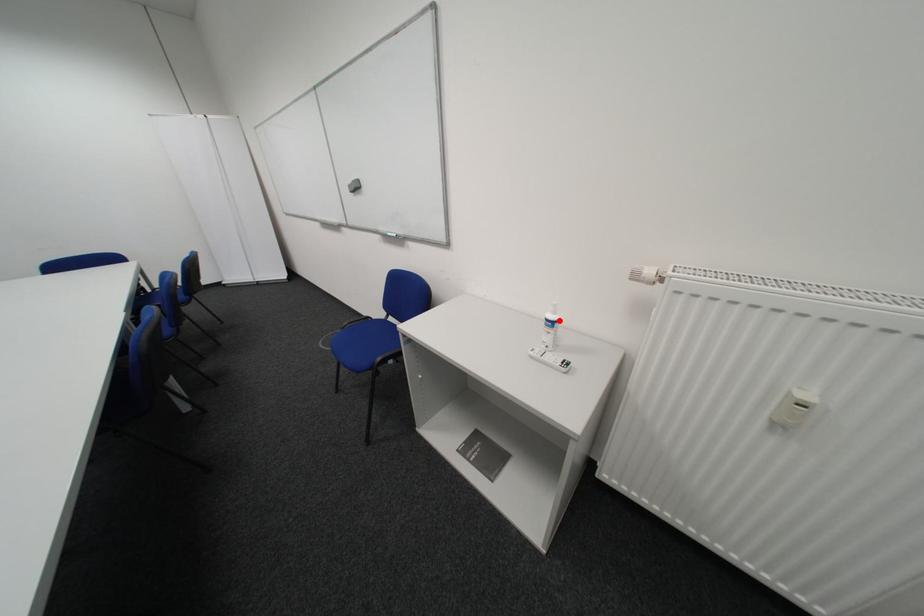
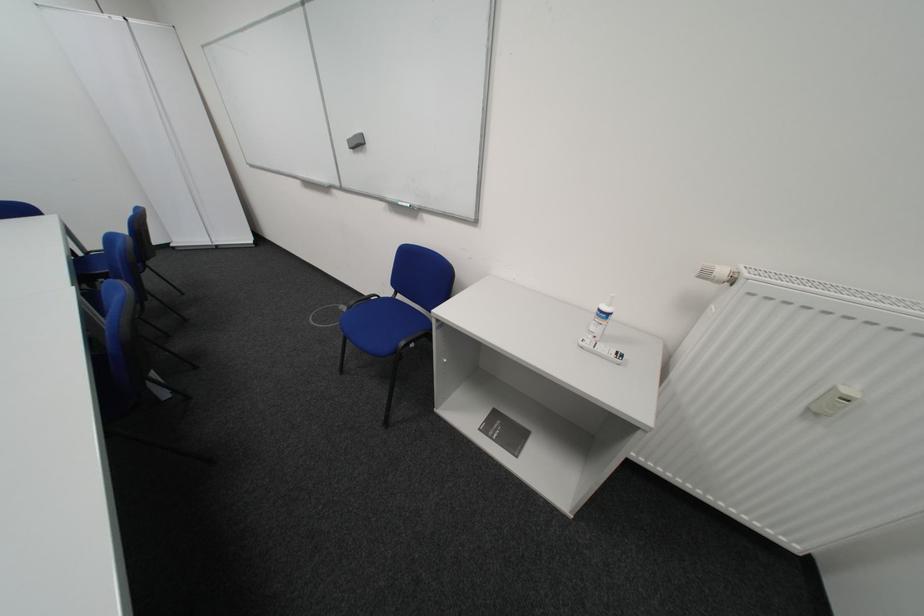
Where in the second image is the point corresponding to the highlighted location from the first image?

(611, 312)